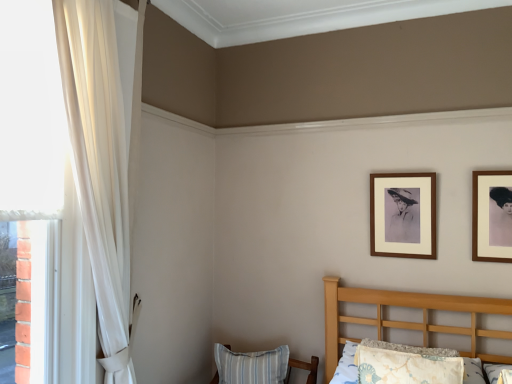
Question: From the image's perspective, relative to fluffy white pillow at lower right, which is the 1th pillow from front to back, is wooden picture frame at upper right, positioned as the 1th picture frame in right-to-left order, above or below?

Choices:
 (A) below
 (B) above

Answer: (B)

Question: Looking at the image, does wooden picture frame at upper right, which is the second picture frame in back-to-front order, seem bigger or smaller compared to fluffy white pillow at lower right, which is the 1th pillow from front to back?

Choices:
 (A) big
 (B) small

Answer: (B)

Question: Which object is positioned closest to the fluffy white pillow at lower right, the first pillow in the right-to-left sequence?

Choices:
 (A) wooden picture frame at upper right, positioned as the second picture frame in left-to-right order
 (B) blue striped pillow at lower center, the first pillow positioned from the bottom
 (C) brown wooden picture frame at upper right, which is counted as the second picture frame, starting from the right
 (D) sheer white curtain at left

Answer: (C)

Question: Which object is positioned closest to the fluffy white pillow at lower right, the 2th pillow positioned from the left?

Choices:
 (A) wooden picture frame at upper right, positioned as the 1th picture frame in right-to-left order
 (B) sheer white curtain at left
 (C) blue striped pillow at lower center, the 1th pillow when ordered from left to right
 (D) brown wooden picture frame at upper right, which is the 2th picture frame in front-to-back order

Answer: (D)